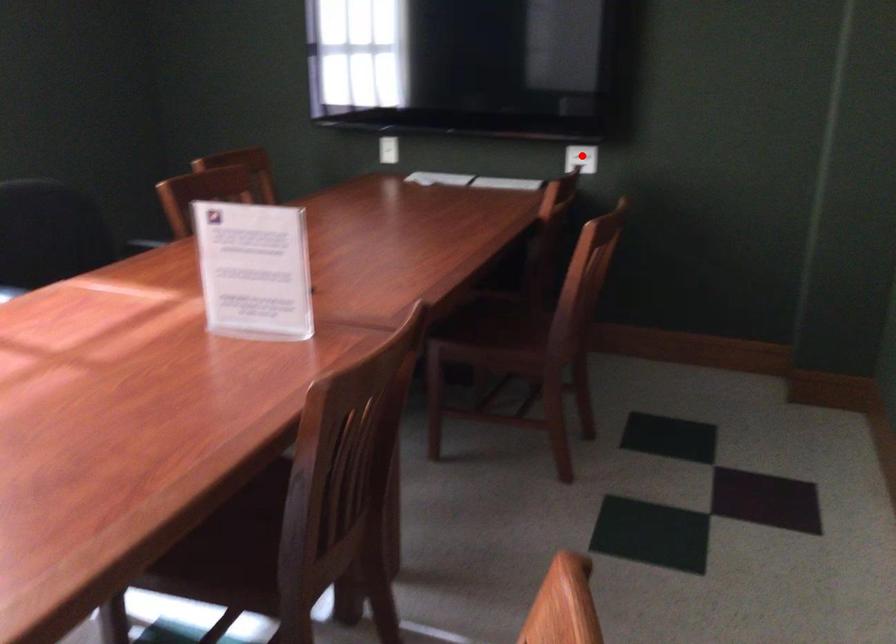
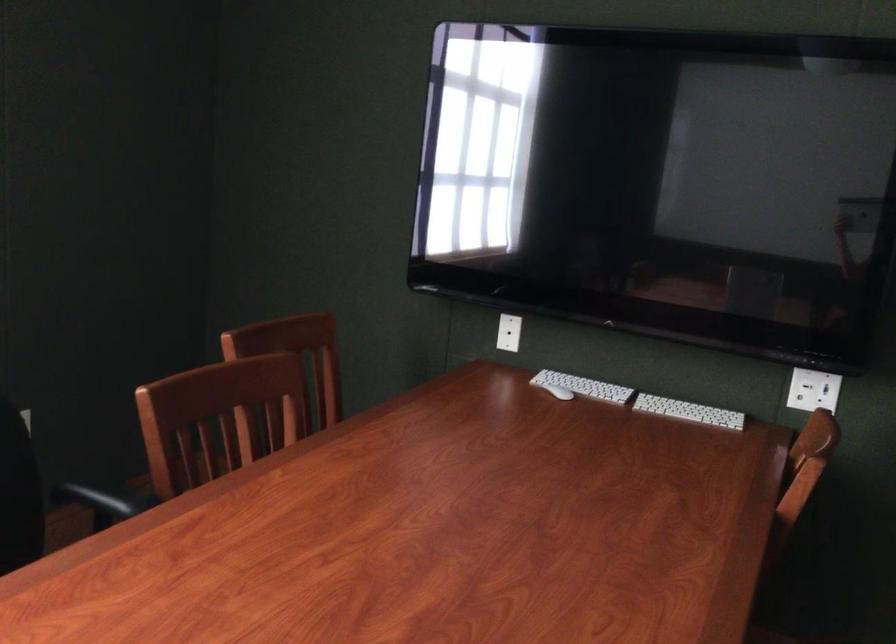
Question: I am providing you with two images of the same scene from different viewpoints. Given a red point in image1, look at the same physical point in image2. Is it:

Choices:
 (A) Closer to the viewpoint
 (B) Farther from the viewpoint

Answer: (A)